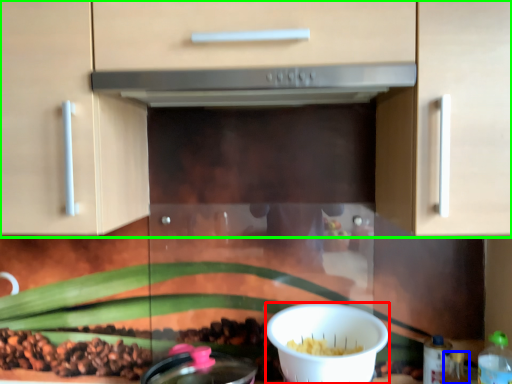
Question: Considering the real-world distances, which object is farthest from bowl (highlighted by a red box)? bottle (highlighted by a blue box) or cabinetry (highlighted by a green box)?

Choices:
 (A) bottle
 (B) cabinetry

Answer: (B)